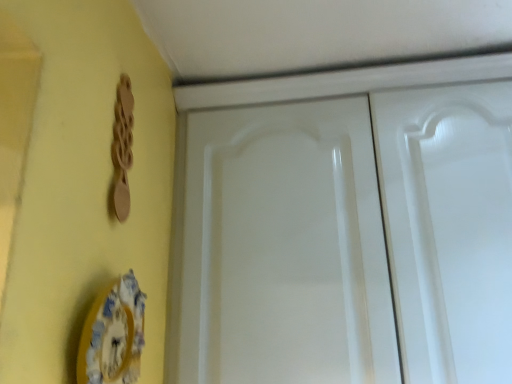
Question: Can porcelain plate at lower left be found inside wooden spoon at upper left?

Choices:
 (A) yes
 (B) no

Answer: (B)

Question: Is the depth of wooden spoon at upper left less than that of porcelain plate at lower left?

Choices:
 (A) yes
 (B) no

Answer: (B)

Question: Considering the relative sizes of wooden spoon at upper left and porcelain plate at lower left in the image provided, is wooden spoon at upper left smaller than porcelain plate at lower left?

Choices:
 (A) yes
 (B) no

Answer: (A)

Question: Is wooden spoon at upper left at the left side of porcelain plate at lower left?

Choices:
 (A) yes
 (B) no

Answer: (A)

Question: Does wooden spoon at upper left touch porcelain plate at lower left?

Choices:
 (A) no
 (B) yes

Answer: (A)

Question: Would you say wooden spoon at upper left is outside porcelain plate at lower left?

Choices:
 (A) no
 (B) yes

Answer: (B)

Question: Can wooden spoon at upper left be found inside porcelain plate at lower left?

Choices:
 (A) no
 (B) yes

Answer: (A)

Question: Is porcelain plate at lower left shorter than wooden spoon at upper left?

Choices:
 (A) no
 (B) yes

Answer: (B)

Question: Can you confirm if porcelain plate at lower left is positioned to the right of wooden spoon at upper left?

Choices:
 (A) no
 (B) yes

Answer: (B)

Question: Is porcelain plate at lower left further to the viewer compared to wooden spoon at upper left?

Choices:
 (A) no
 (B) yes

Answer: (A)

Question: From the image's perspective, does porcelain plate at lower left appear lower than wooden spoon at upper left?

Choices:
 (A) no
 (B) yes

Answer: (B)

Question: From a real-world perspective, is porcelain plate at lower left positioned under wooden spoon at upper left based on gravity?

Choices:
 (A) yes
 (B) no

Answer: (A)

Question: Is white glossy cabinet doors at center facing towards wooden spoon at upper left?

Choices:
 (A) yes
 (B) no

Answer: (A)